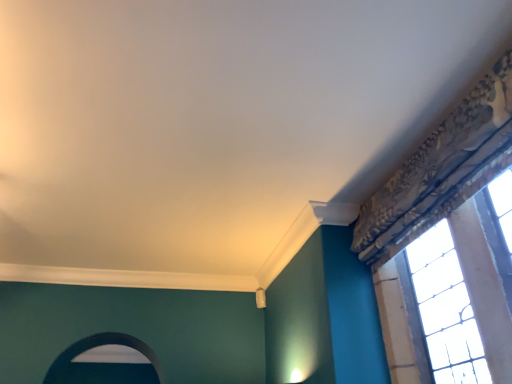
What do you see at coordinates (105, 362) in the screenshot?
I see `smooth white archway at lower left` at bounding box center [105, 362].

In order to face smooth white archway at lower left, should I rotate leftwards or rightwards?

Rotate left and turn 18.603 degrees.

Where is `smooth white archway at lower left`? Image resolution: width=512 pixels, height=384 pixels. smooth white archway at lower left is located at coordinates (105, 362).

The width and height of the screenshot is (512, 384). Describe the element at coordinates (452, 296) in the screenshot. I see `stained glass window at upper right` at that location.

The width and height of the screenshot is (512, 384). I want to click on stained glass window at upper right, so click(x=452, y=296).

Identify the location of smooth white archway at lower left. (105, 362).

Can you confirm if stained glass window at upper right is positioned to the right of smooth white archway at lower left?

Correct, you'll find stained glass window at upper right to the right of smooth white archway at lower left.

Does stained glass window at upper right come in front of smooth white archway at lower left?

Yes, stained glass window at upper right is in front of smooth white archway at lower left.

Is point (421, 256) closer to viewer compared to point (71, 370)?

Yes.

From the image's perspective, is stained glass window at upper right located above or below smooth white archway at lower left?

Clearly, from the image's perspective, stained glass window at upper right is above smooth white archway at lower left.

From a real-world perspective, is stained glass window at upper right on top of smooth white archway at lower left?

No, from a real-world perspective, stained glass window at upper right is not over smooth white archway at lower left

Looking at their sizes, would you say stained glass window at upper right is wider or thinner than smooth white archway at lower left?

Clearly, stained glass window at upper right has less width compared to smooth white archway at lower left.

Can you confirm if stained glass window at upper right is taller than smooth white archway at lower left?

Yes, stained glass window at upper right is taller than smooth white archway at lower left.

Considering the relative sizes of stained glass window at upper right and smooth white archway at lower left in the image provided, is stained glass window at upper right bigger than smooth white archway at lower left?

Yes, stained glass window at upper right is bigger than smooth white archway at lower left.

Is stained glass window at upper right surrounding smooth white archway at lower left?

No, stained glass window at upper right does not contain smooth white archway at lower left.

Consider the image. Is stained glass window at upper right not near smooth white archway at lower left?

That's right, there is a large distance between stained glass window at upper right and smooth white archway at lower left.

Could you tell me if stained glass window at upper right is facing smooth white archway at lower left?

No, stained glass window at upper right is not facing towards smooth white archway at lower left.

Locate an element on the screen. The image size is (512, 384). window located on the right of smooth white archway at lower left is located at coordinates (452, 296).

Would you say smooth white archway at lower left is to the left or to the right of stained glass window at upper right in the picture?

Based on their positions, smooth white archway at lower left is located to the left of stained glass window at upper right.

In the scene shown: Considering the relative positions of smooth white archway at lower left and stained glass window at upper right in the image provided, is smooth white archway at lower left behind stained glass window at upper right?

That is True.

Which is in front, point (59, 368) or point (416, 285)?

The point (416, 285) is more forward.

From the image's perspective, is smooth white archway at lower left under stained glass window at upper right?

Yes, from the image's perspective, smooth white archway at lower left is beneath stained glass window at upper right.

Consider the image. From a real-world perspective, who is located higher, smooth white archway at lower left or stained glass window at upper right?

From a 3D spatial view, smooth white archway at lower left is above.

Considering the sizes of objects smooth white archway at lower left and stained glass window at upper right in the image provided, who is wider, smooth white archway at lower left or stained glass window at upper right?

With larger width is smooth white archway at lower left.

Does smooth white archway at lower left have a greater height compared to stained glass window at upper right?

No.

Is smooth white archway at lower left bigger or smaller than stained glass window at upper right?

smooth white archway at lower left is smaller than stained glass window at upper right.

Is smooth white archway at lower left surrounding stained glass window at upper right?

No, smooth white archway at lower left does not contain stained glass window at upper right.

Is smooth white archway at lower left next to stained glass window at upper right and touching it?

No, smooth white archway at lower left is not touching stained glass window at upper right.

Is smooth white archway at lower left aimed at stained glass window at upper right?

No, smooth white archway at lower left is not turned towards stained glass window at upper right.

Can you tell me how much smooth white archway at lower left and stained glass window at upper right differ in facing direction?

90.2 degrees.

Looking at this image, measure the distance from smooth white archway at lower left to stained glass window at upper right.

The distance of smooth white archway at lower left from stained glass window at upper right is 6.22 feet.

The height and width of the screenshot is (384, 512). Find the location of `archway lying below the stained glass window at upper right (from the image's perspective)`. archway lying below the stained glass window at upper right (from the image's perspective) is located at coordinates (105, 362).

Identify the location of archway that is below the stained glass window at upper right (from the image's perspective). (105, 362).

Locate an element on the screen. archway behind the stained glass window at upper right is located at coordinates (105, 362).